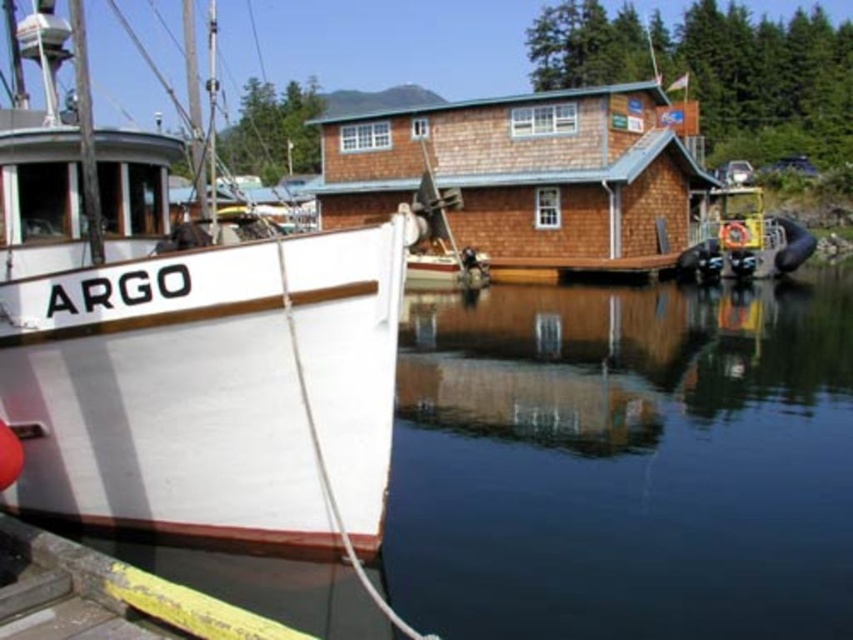
You are standing on the dock and want to take a photo of the boat named ARGO. Where should you position yourself to ensure the clear water at lower left is visible in the frame?

You should position yourself at point [625,461] to include the clear water at lower left in your photo.

You are standing on the dock and looking at the scene. Which object is closer to you, the clear water at lower left or the white matte boat at left?

The clear water at lower left is closer to you because it is positioned over the white matte boat at left, indicating it is in front spatially.